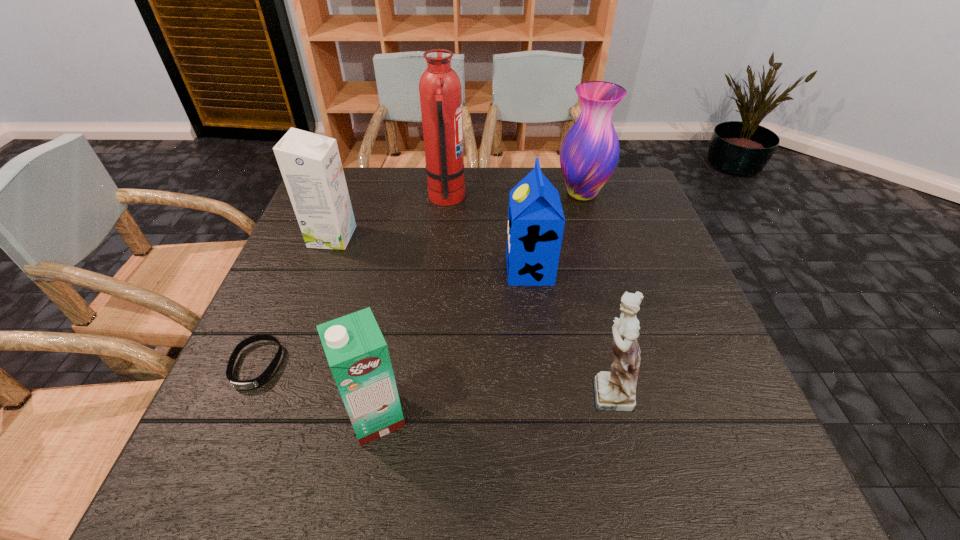
What are the coordinates of `unoccupied area between the figurine and the fifth object from left to right` in the screenshot? It's located at (567, 330).

Identify the location of free space that is in between the figurine and the fire extinguisher. coord(526,294).

I want to click on free spot between the second carton from left to right and the tallest object, so click(411, 307).

Where is `vacant space that is in between the wristband and the tallest object`? This screenshot has height=540, width=960. vacant space that is in between the wristband and the tallest object is located at coordinates (351, 281).

What are the coordinates of `object that stands as the closest to the figurine` in the screenshot? It's located at (536, 221).

Find the location of a particular element. Image resolution: width=960 pixels, height=540 pixels. object that is the fourth closest to the figurine is located at coordinates (440, 89).

The height and width of the screenshot is (540, 960). In order to click on carton that can be found as the closest to the shortest object in this screenshot , I will do `click(357, 353)`.

Image resolution: width=960 pixels, height=540 pixels. I want to click on carton that is the third closest to the vase, so pos(357,353).

This screenshot has width=960, height=540. I want to click on vacant space that satisfies the following two spatial constraints: 1. with the cap open on the second farthest carton; 2. on the display of the shortest object, so click(540, 365).

This screenshot has width=960, height=540. I want to click on free space that satisfies the following two spatial constraints: 1. on the label side of the fire extinguisher; 2. on the display of the wristband, so click(x=430, y=365).